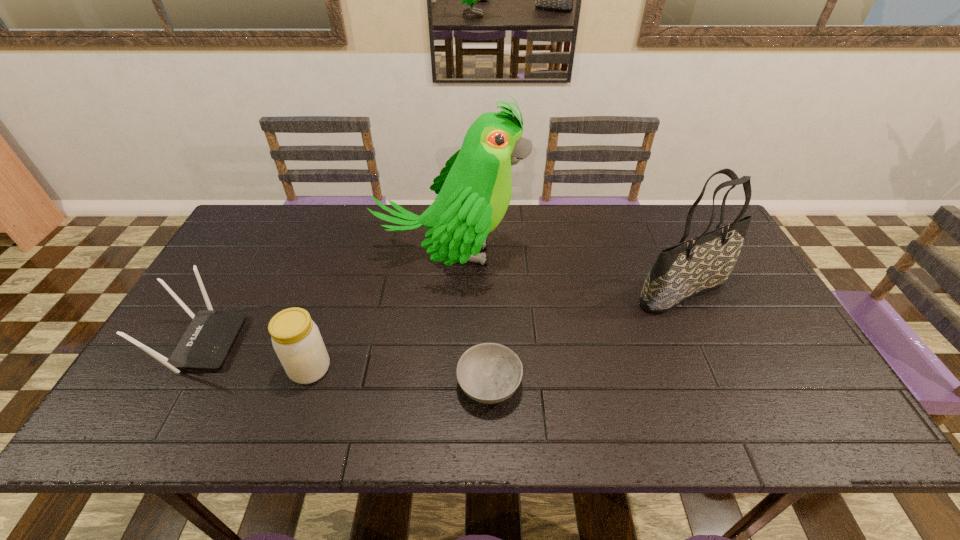
Image resolution: width=960 pixels, height=540 pixels. What are the coordinates of `parakeet` in the screenshot? It's located at (474, 189).

Identify the location of tote bag. The image size is (960, 540). (704, 263).

The height and width of the screenshot is (540, 960). What are the coordinates of `the fourth shortest object` in the screenshot? It's located at (704, 263).

The image size is (960, 540). What are the coordinates of `the second object from left to right` in the screenshot? It's located at (296, 339).

Where is `the leftmost object`? The width and height of the screenshot is (960, 540). the leftmost object is located at coordinates (205, 344).

Locate an element on the screen. This screenshot has height=540, width=960. the shortest object is located at coordinates (489, 373).

Image resolution: width=960 pixels, height=540 pixels. What are the coordinates of `vacant space located on the beak of the tallest object` in the screenshot? It's located at (649, 255).

Image resolution: width=960 pixels, height=540 pixels. Find the location of `free spot located on the left of the tote bag`. free spot located on the left of the tote bag is located at coordinates (539, 292).

Locate an element on the screen. free location located on the back of the jar is located at coordinates (334, 294).

Find the location of `vacant region located 0.180m on the front-facing side of the router`. vacant region located 0.180m on the front-facing side of the router is located at coordinates (307, 343).